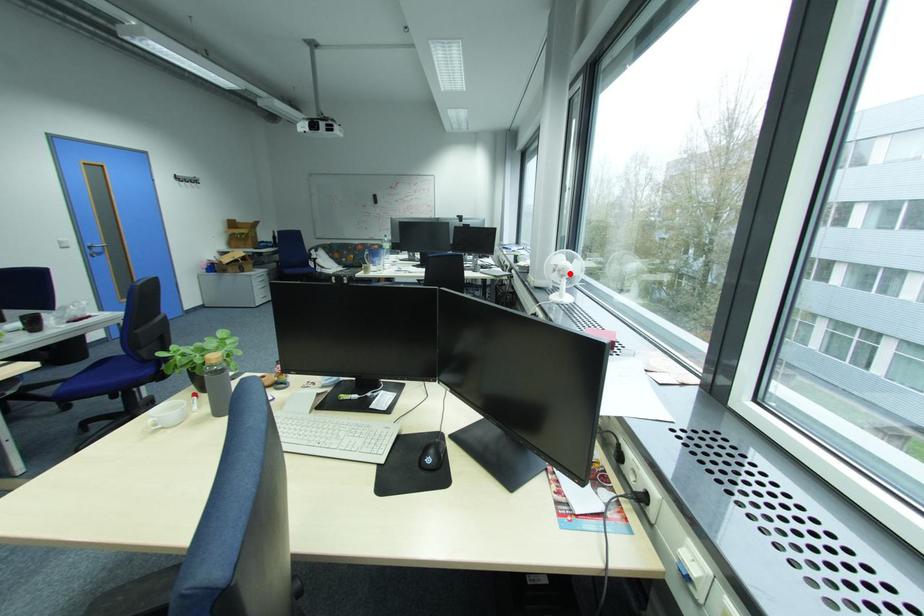
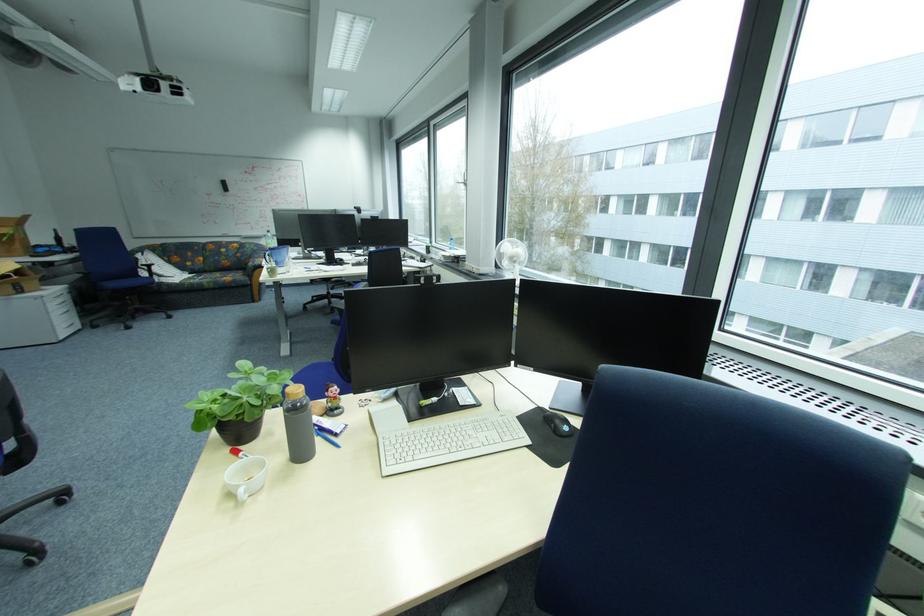
Where in the second image is the point corresponding to the highlighted location from the first image?

(524, 259)